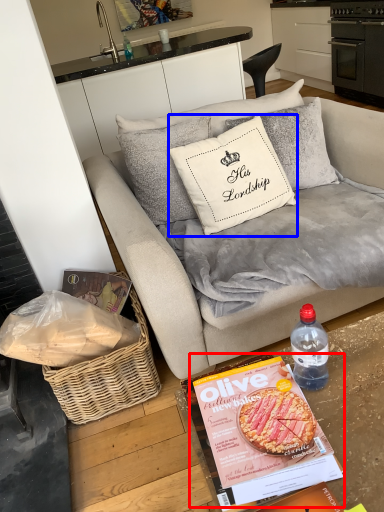
Question: Which object appears closest to the camera in this image, magazine (highlighted by a red box) or pillow (highlighted by a blue box)?

Choices:
 (A) magazine
 (B) pillow

Answer: (A)